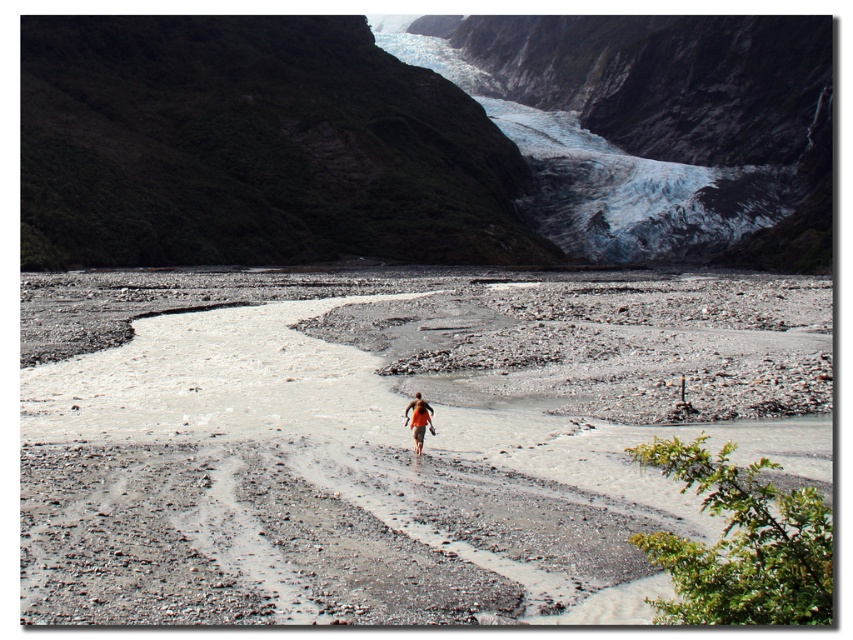
You are a hiker planning to travel from the green mossy rock at upper left to the blue ice glacier at upper center. Given that your average walking pace is 5 kilometers per hour, how long approximately would it take you to reach the glacier?

The distance between the green mossy rock at upper left and the blue ice glacier at upper center is 88.35 meters. Converting this to kilometers gives 0.08835 km. Dividing by your walking speed of 5 km per hour yields approximately 0.01767 hours. Multiplying by 60 minutes gives roughly 1.06 minutes, so it would take about 1 minute to reach the glacier.

You are a photographer planning to capture the entire scene, including the green mossy rock at upper left and the blue ice glacier at upper center. Based on their sizes, which object should you prioritize focusing on to ensure it stands out in the photo?

The blue ice glacier at upper center is taller than the green mossy rock at upper left, so it should be prioritized for focus to ensure it stands out in the photo.